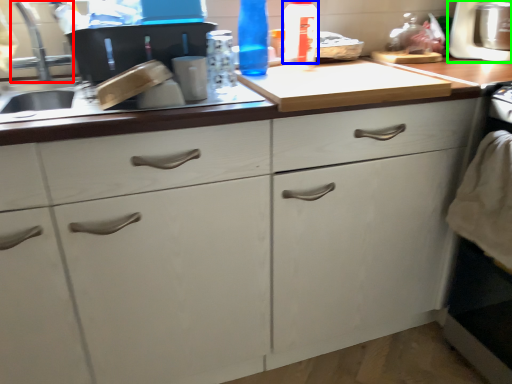
Question: Estimate the real-world distances between objects in this image. Which object is farther from faucet (highlighted by a red box), bottle (highlighted by a blue box) or appliance (highlighted by a green box)?

Choices:
 (A) bottle
 (B) appliance

Answer: (B)